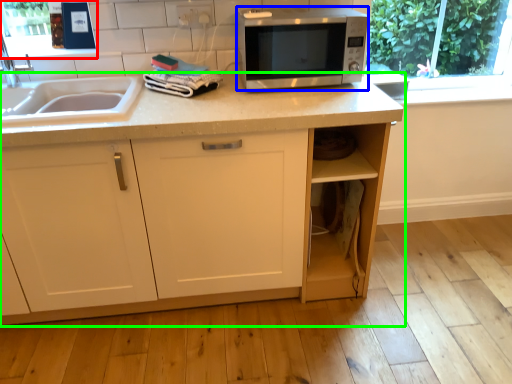
Question: Which object is positioned closest to window screen (highlighted by a red box)? Select from microwave oven (highlighted by a blue box) and cabinetry (highlighted by a green box).

Choices:
 (A) microwave oven
 (B) cabinetry

Answer: (B)